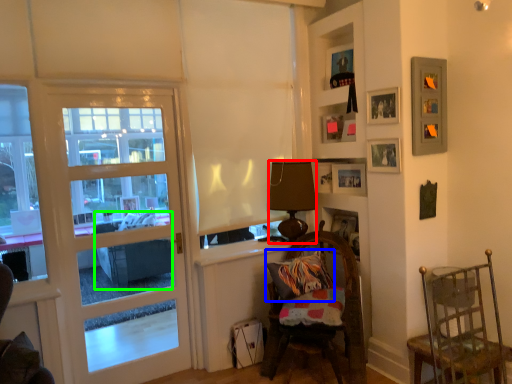
Question: Estimate the real-world distances between objects in this image. Which object is farther from lamp (highlighted by a red box), pillow (highlighted by a blue box) or studio couch (highlighted by a green box)?

Choices:
 (A) pillow
 (B) studio couch

Answer: (B)